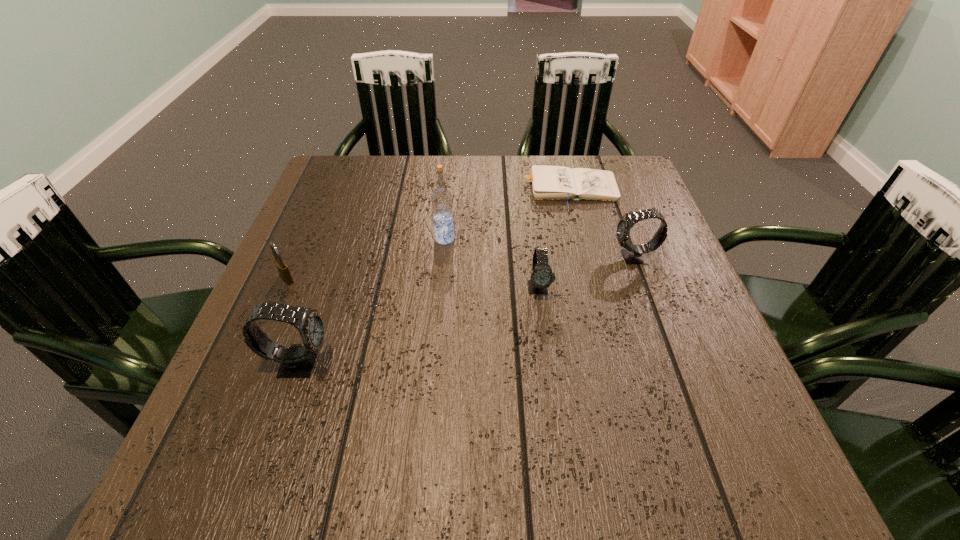
Identify the location of vodka. (441, 199).

The width and height of the screenshot is (960, 540). In order to click on vacant space located on the face of the nearest object in this screenshot , I will do `click(531, 363)`.

This screenshot has width=960, height=540. In order to click on vacant region located 0.060m on the face of the second nearest watch in this screenshot , I will do `click(543, 325)`.

Where is `free space located on the face of the farthest watch`? free space located on the face of the farthest watch is located at coordinates (577, 258).

At what (x,y) coordinates should I click in order to perform the action: click on free space located on the face of the farthest watch. Please return your answer as a coordinate pair (x, y). Looking at the image, I should click on (449, 258).

Where is `vacant region located 0.240m on the face of the farthest watch`? The width and height of the screenshot is (960, 540). vacant region located 0.240m on the face of the farthest watch is located at coordinates (507, 258).

Locate an element on the screen. The height and width of the screenshot is (540, 960). vacant region located on the front of the farthest object is located at coordinates (603, 325).

Identify the location of free space located 0.360m on the back of the leftmost object. pos(329,181).

Where is `vacant area situated on the left of the vodka`? vacant area situated on the left of the vodka is located at coordinates (308, 239).

Where is `object at the far edge`? The height and width of the screenshot is (540, 960). object at the far edge is located at coordinates (548, 182).